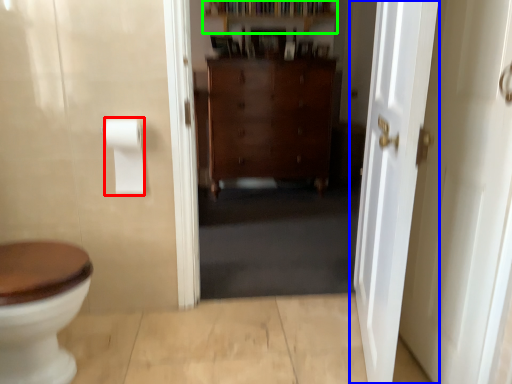
Question: Which is farther away from to paper towel (highlighted by a red box)? door (highlighted by a blue box) or shelf (highlighted by a green box)?

Choices:
 (A) door
 (B) shelf

Answer: (B)